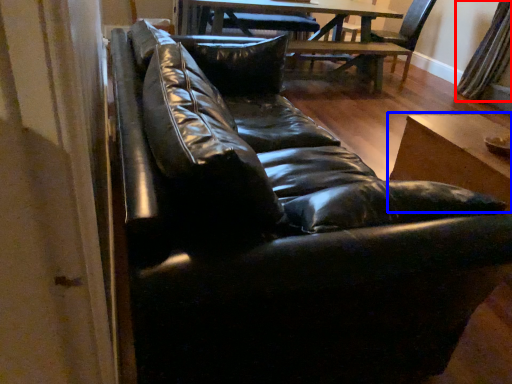
Question: Among these objects, which one is nearest to the camera, curtain (highlighted by a red box) or table (highlighted by a blue box)?

Choices:
 (A) curtain
 (B) table

Answer: (B)